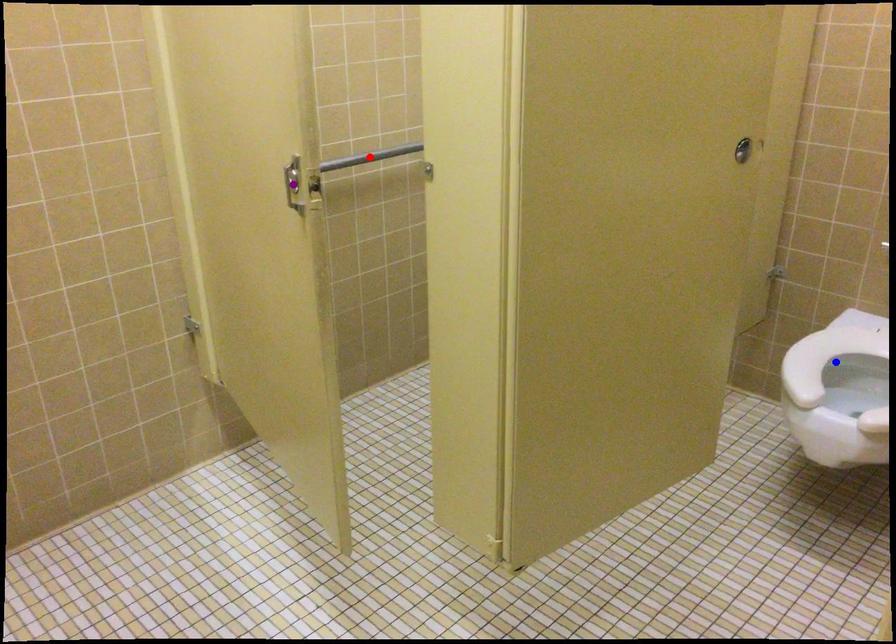
Order these from nearest to farthest:
blue point, purple point, red point

purple point < blue point < red point